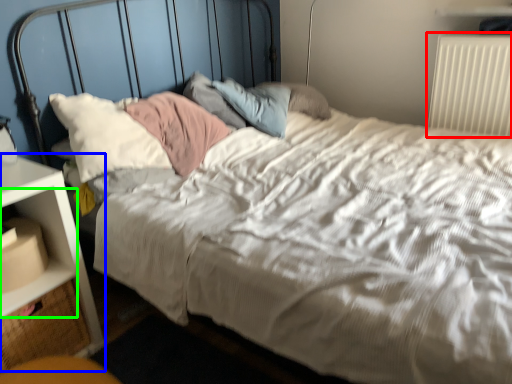
Question: Based on their relative distances, which object is nearer to radiator (highlighted by a red box)? Choose from nightstand (highlighted by a blue box) and shelf (highlighted by a green box).

Choices:
 (A) nightstand
 (B) shelf

Answer: (A)